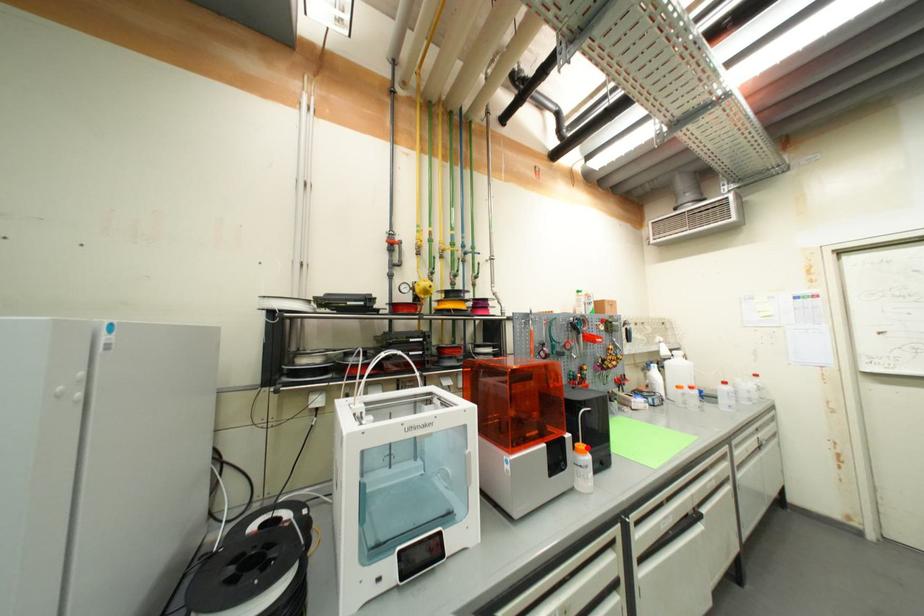
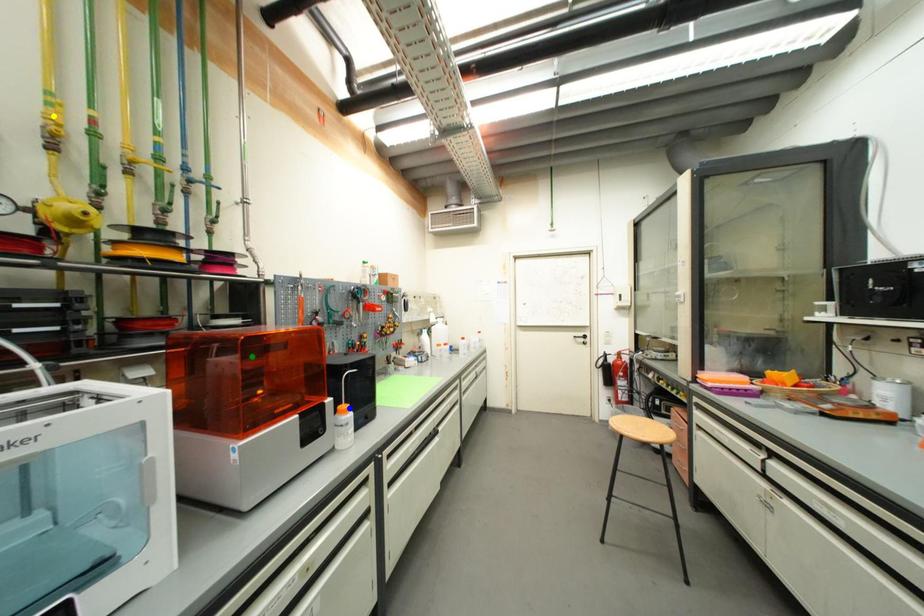
Question: I am providing you with two images of the same scene from different viewpoints. A red point is marked on the first image. You are given multiple points on the second image. Which point in image 2 represents the same 3d spot as the red point in image 1?

Choices:
 (A) yellow point
 (B) green point
 (C) blue point

Answer: (C)